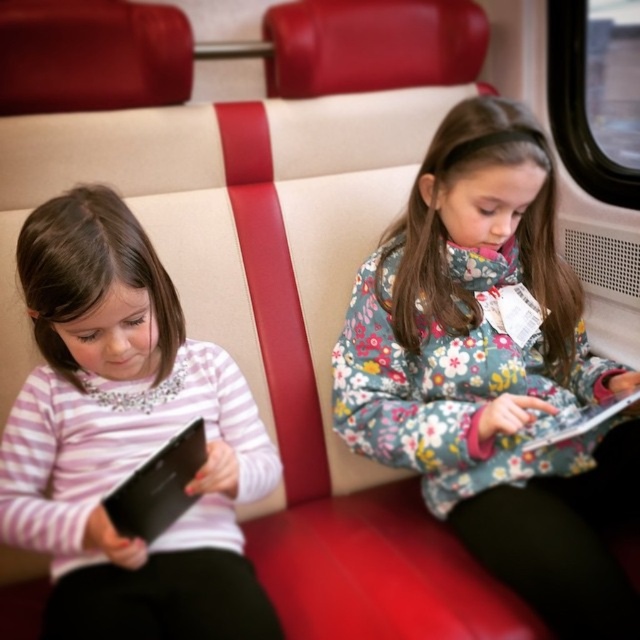
Question: Which point is farther to the camera?

Choices:
 (A) pink striped shirt at left
 (B) floral fabric jacket at center

Answer: (B)

Question: Among these points, which one is farthest from the camera?

Choices:
 (A) [x=528, y=552]
 (B) [x=182, y=520]

Answer: (B)

Question: Among these objects, which one is farthest from the camera?

Choices:
 (A) pink striped shirt at left
 (B) floral fabric jacket at center

Answer: (B)

Question: Is floral fabric jacket at center smaller than pink striped shirt at left?

Choices:
 (A) yes
 (B) no

Answer: (B)

Question: Is floral fabric jacket at center to the left of pink striped shirt at left from the viewer's perspective?

Choices:
 (A) no
 (B) yes

Answer: (A)

Question: Does floral fabric jacket at center have a larger size compared to pink striped shirt at left?

Choices:
 (A) yes
 (B) no

Answer: (A)